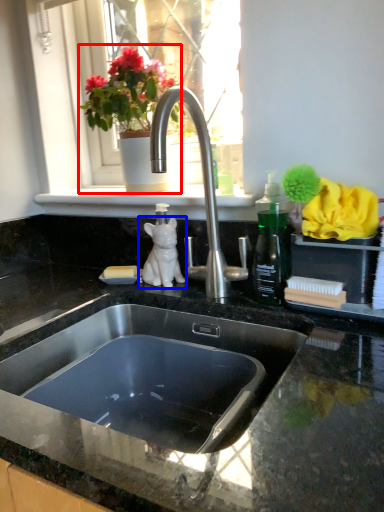
Question: Which point is closer to the camera, houseplant (highlighted by a red box) or animal (highlighted by a blue box)?

Choices:
 (A) houseplant
 (B) animal

Answer: (A)